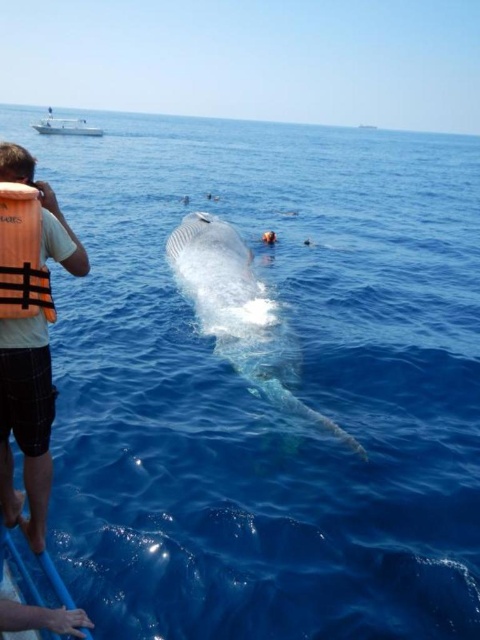
Question: Is orange fabric life jacket at left wider than white glossy boat at upper left?

Choices:
 (A) yes
 (B) no

Answer: (B)

Question: Considering the relative positions of gray matte whale at center and orange fabric life jacket at left in the image provided, where is gray matte whale at center located with respect to orange fabric life jacket at left?

Choices:
 (A) above
 (B) below

Answer: (B)

Question: Is orange fabric life jacket at left thinner than white glossy boat at upper left?

Choices:
 (A) no
 (B) yes

Answer: (B)

Question: Among these points, which one is nearest to the camera?

Choices:
 (A) (55, 257)
 (B) (295, 396)
 (C) (91, 134)

Answer: (A)

Question: Which of the following is the farthest from the observer?

Choices:
 (A) white glossy boat at upper left
 (B) gray matte whale at center
 (C) orange life vest at left

Answer: (A)

Question: Based on their relative distances, which object is farther from the white glossy boat at upper left?

Choices:
 (A) orange life vest at left
 (B) gray matte whale at center
 (C) orange fabric life jacket at left

Answer: (A)